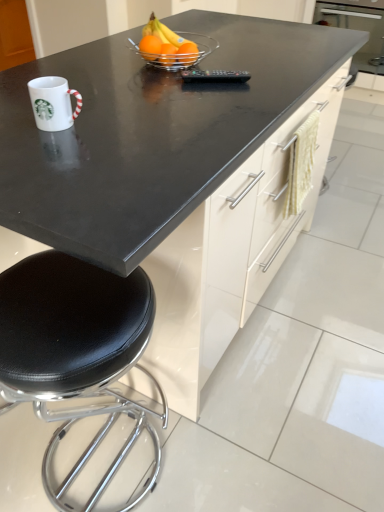
Find the location of a particular element. free spot above black leather stool at lower left (from a real-world perspective) is located at coordinates (71, 306).